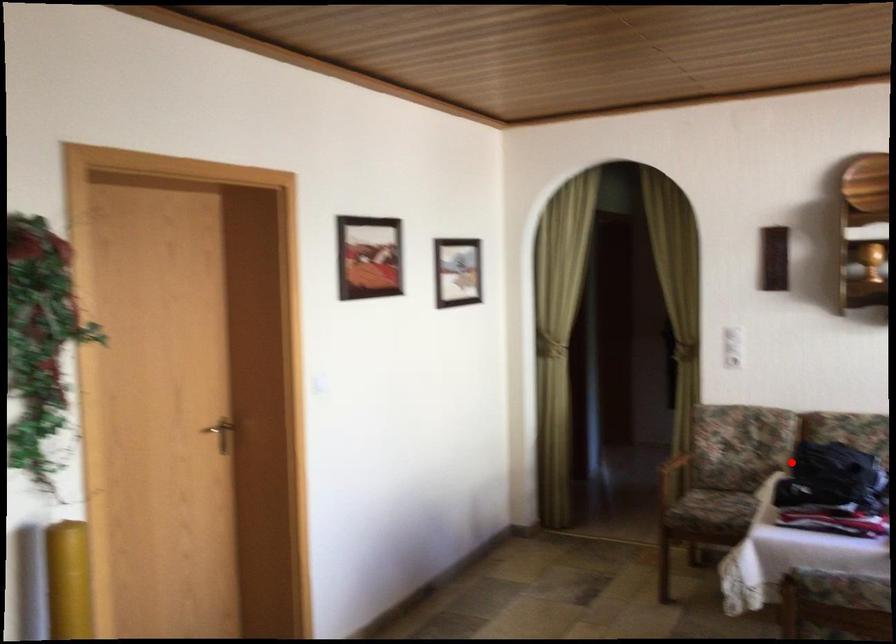
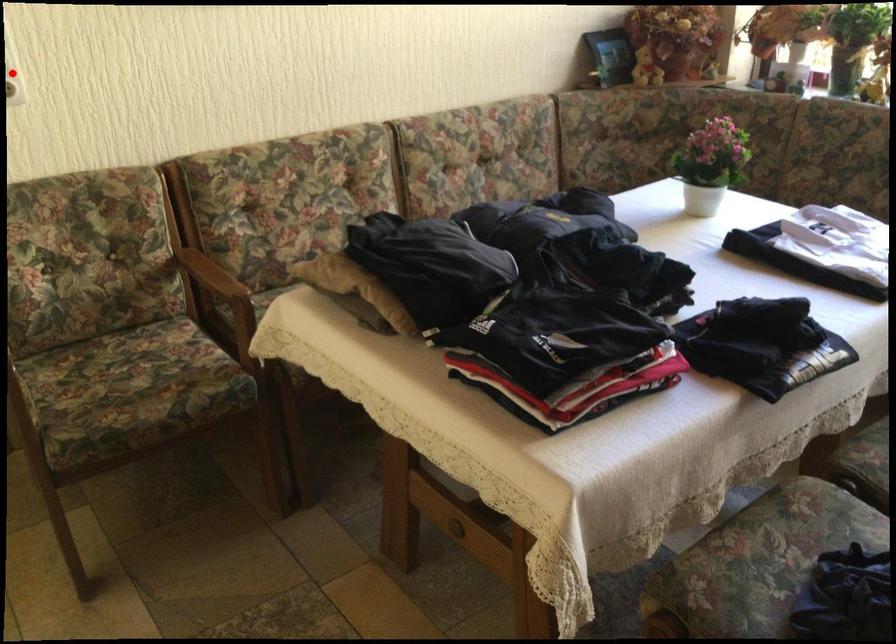
I am providing you with two images of the same scene from different viewpoints. A red point is marked on the first image and another point is marked on the second image. Is the red point in image1 aligned with the point shown in image2?

No